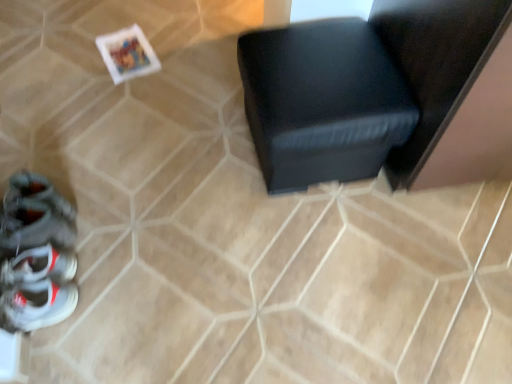
Question: Is black leather ottoman at center thinner than shiny gray sneaker at lower left?

Choices:
 (A) yes
 (B) no

Answer: (B)

Question: Is black leather ottoman at center looking in the opposite direction of shiny gray sneaker at lower left?

Choices:
 (A) no
 (B) yes

Answer: (A)

Question: Does black leather ottoman at center appear on the right side of shiny gray sneaker at lower left?

Choices:
 (A) yes
 (B) no

Answer: (A)

Question: From a real-world perspective, is black leather ottoman at center on top of shiny gray sneaker at lower left?

Choices:
 (A) yes
 (B) no

Answer: (A)

Question: Is black leather ottoman at center oriented towards shiny gray sneaker at lower left?

Choices:
 (A) no
 (B) yes

Answer: (A)

Question: From a real-world perspective, is black leather ottoman at center located beneath shiny gray sneaker at lower left?

Choices:
 (A) yes
 (B) no

Answer: (B)

Question: Is black leather ottoman at center at the back of shiny gray sneaker at lower left?

Choices:
 (A) yes
 (B) no

Answer: (A)

Question: Are shiny gray sneaker at lower left and black leather ottoman at center making contact?

Choices:
 (A) yes
 (B) no

Answer: (B)

Question: Is shiny gray sneaker at lower left not near black leather ottoman at center?

Choices:
 (A) no
 (B) yes

Answer: (A)

Question: Is shiny gray sneaker at lower left positioned beyond the bounds of black leather ottoman at center?

Choices:
 (A) yes
 (B) no

Answer: (A)

Question: Is shiny gray sneaker at lower left positioned before black leather ottoman at center?

Choices:
 (A) yes
 (B) no

Answer: (B)

Question: Does shiny gray sneaker at lower left appear on the left side of black leather ottoman at center?

Choices:
 (A) yes
 (B) no

Answer: (A)

Question: Is white leather sneakers at lower left to the right of black leather ottoman at center from the viewer's perspective?

Choices:
 (A) no
 (B) yes

Answer: (A)